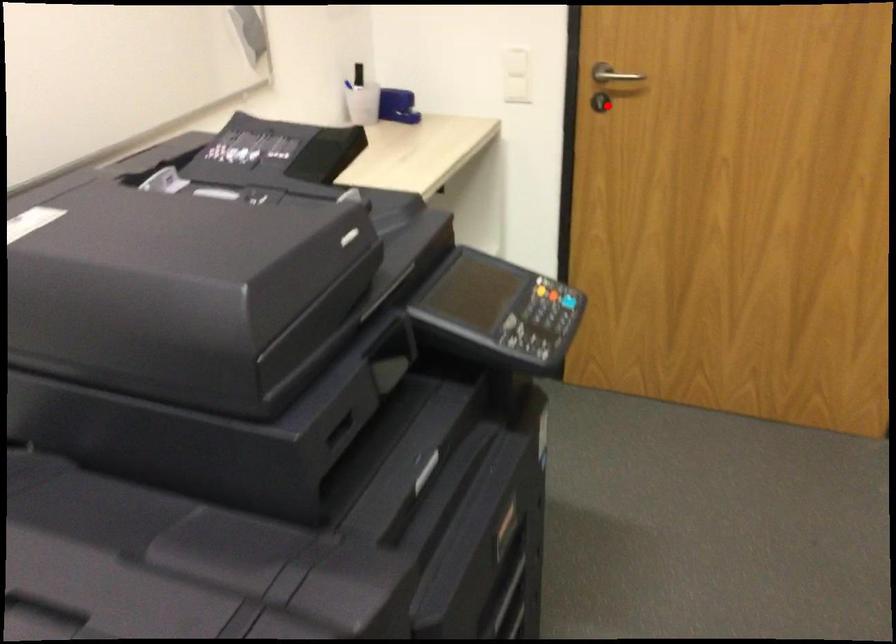
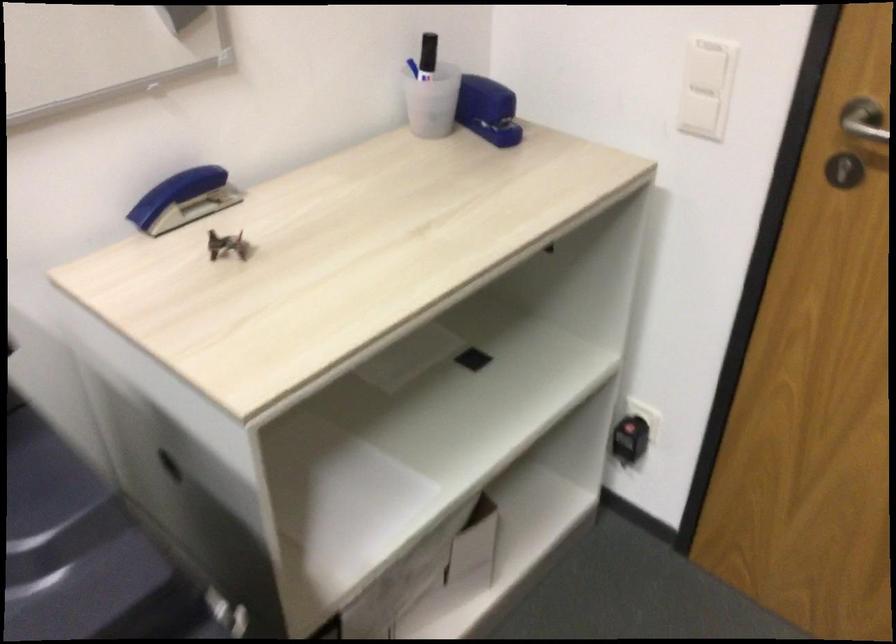
In the second image, find the point that corresponds to the highlighted location in the first image.

(843, 169)